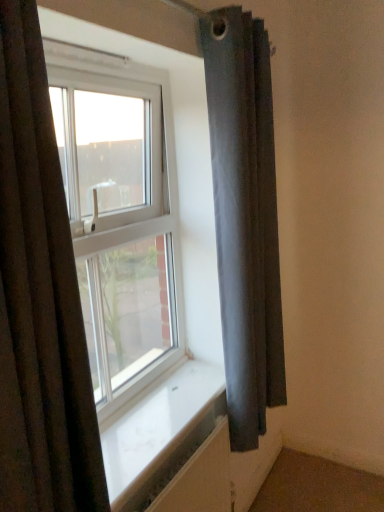
Question: From the image's perspective, is transparent glass window at center above white smooth window sill at center?

Choices:
 (A) yes
 (B) no

Answer: (A)

Question: Is transparent glass window at center oriented towards white smooth window sill at center?

Choices:
 (A) no
 (B) yes

Answer: (B)

Question: Does transparent glass window at center have a greater width compared to white smooth window sill at center?

Choices:
 (A) no
 (B) yes

Answer: (A)

Question: Considering the relative positions of transparent glass window at center and white smooth window sill at center in the image provided, is transparent glass window at center behind white smooth window sill at center?

Choices:
 (A) yes
 (B) no

Answer: (A)

Question: Can you confirm if transparent glass window at center is smaller than white smooth window sill at center?

Choices:
 (A) yes
 (B) no

Answer: (B)

Question: Does point (135, 390) appear closer or farther from the camera than point (165, 386)?

Choices:
 (A) farther
 (B) closer

Answer: (B)

Question: From the image's perspective, is transparent glass window at center positioned above or below white smooth window sill at center?

Choices:
 (A) above
 (B) below

Answer: (A)

Question: Which is correct: transparent glass window at center is inside white smooth window sill at center, or outside of it?

Choices:
 (A) outside
 (B) inside

Answer: (A)

Question: From a real-world perspective, is transparent glass window at center positioned above or below white smooth window sill at center?

Choices:
 (A) below
 (B) above

Answer: (B)

Question: Is dark gray fabric curtain at right, the 1th curtain in the right-to-left sequence, in front of or behind white smooth window sill at center in the image?

Choices:
 (A) behind
 (B) front

Answer: (A)

Question: In terms of height, does dark gray fabric curtain at right, placed as the second curtain when sorted from left to right, look taller or shorter compared to white smooth window sill at center?

Choices:
 (A) tall
 (B) short

Answer: (A)

Question: From the image's perspective, is dark gray fabric curtain at right, the 1th curtain in the right-to-left sequence, located above or below white smooth window sill at center?

Choices:
 (A) above
 (B) below

Answer: (A)

Question: Is dark gray fabric curtain at right, the 1th curtain in the right-to-left sequence, wider or thinner than white smooth window sill at center?

Choices:
 (A) wide
 (B) thin

Answer: (B)

Question: Considering the positions of point (142, 416) and point (69, 181), is point (142, 416) closer or farther from the camera than point (69, 181)?

Choices:
 (A) farther
 (B) closer

Answer: (A)

Question: Do you think white smooth window sill at center is within transparent glass window at center, or outside of it?

Choices:
 (A) outside
 (B) inside

Answer: (A)